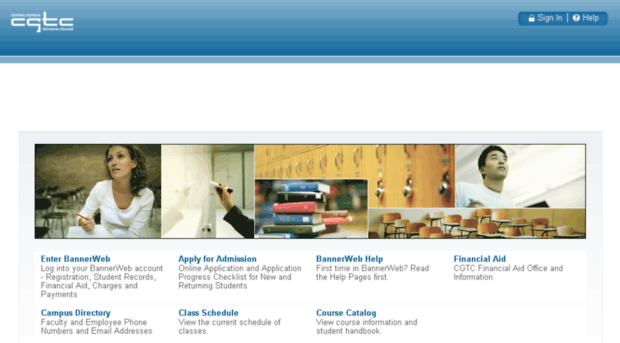
The image size is (620, 343). I want to click on locks, so click(444, 186), click(408, 191), click(379, 193).